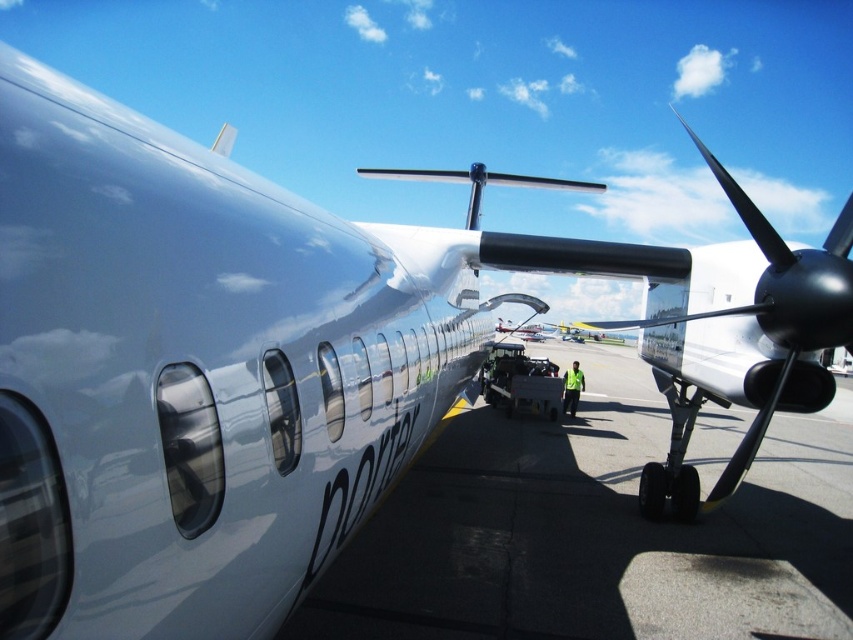
You are a maintenance worker checking the Porter Airlines aircraft. You need to access the shiny black propeller at right for inspection. Is the smooth concrete tarmac at center blocking your direct path to the propeller?

The smooth concrete tarmac at center is in front of the shiny black propeller at right, so it is blocking the direct path to the propeller.

You are standing at the airport and see the Porter Airlines aircraft parked on the smooth concrete tarmac at center. If you want to walk directly to the aircraft from your current position, which direction should you head towards?

The smooth concrete tarmac at center is located at point 0.834 on the x axis and 0.698 on the y axis, so you should head towards the direction of the aircraft on the tarmac.

You are a photographer trying to capture the shiny black propeller at right and the smooth concrete tarmac at center in a single frame. Based on their sizes in the image, which object would you need to position closer to the camera to ensure both fill the frame adequately?

The smooth concrete tarmac at center is smaller in size compared to the shiny black propeller at right. To ensure both fill the frame adequately, you should position the smooth concrete tarmac at center closer to the camera since it is smaller and needs to be magnified more to match the propeller in the frame.